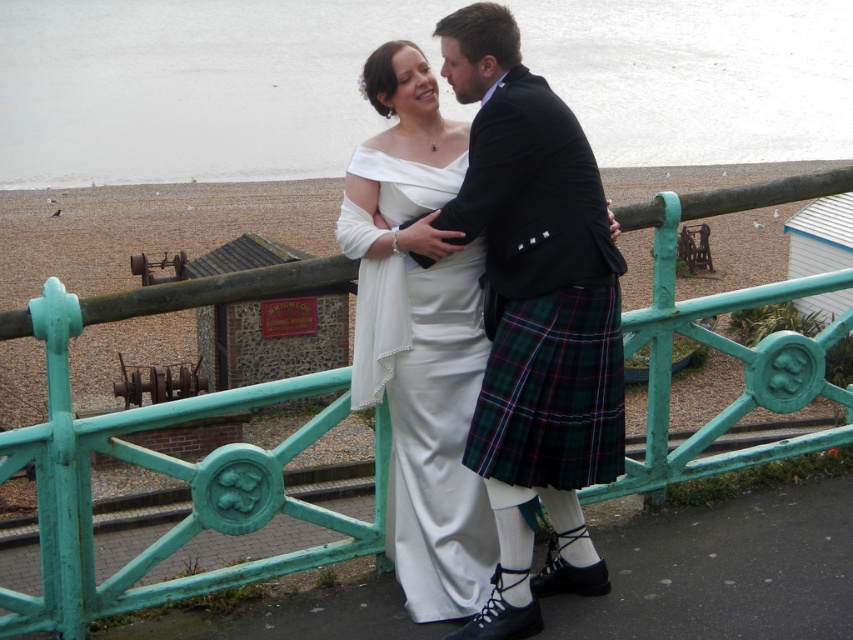
Question: Among these points, which one is nearest to the camera?

Choices:
 (A) (532, 435)
 (B) (563, 513)

Answer: (A)

Question: Which of the following is the farthest from the observer?

Choices:
 (A) (511, 323)
 (B) (509, 224)
 (C) (405, 218)

Answer: (C)

Question: Which is nearer to the matte white dress at center?

Choices:
 (A) white satin dress at center
 (B) green plaid kilt at center

Answer: (B)

Question: Does white satin dress at center have a greater width compared to green plaid kilt at center?

Choices:
 (A) no
 (B) yes

Answer: (B)

Question: Is matte white dress at center bigger than green plaid kilt at center?

Choices:
 (A) yes
 (B) no

Answer: (A)

Question: Is the position of white satin dress at center more distant than that of green plaid kilt at center?

Choices:
 (A) no
 (B) yes

Answer: (B)